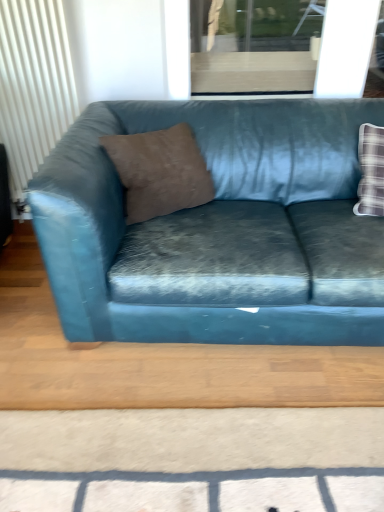
Question: Would you say white textured radiator at left is to the left or to the right of transparent glass window at upper center in the picture?

Choices:
 (A) left
 (B) right

Answer: (A)

Question: From the image's perspective, is white textured radiator at left positioned above or below transparent glass window at upper center?

Choices:
 (A) below
 (B) above

Answer: (A)

Question: Which object is positioned farthest from the white textured radiator at left?

Choices:
 (A) teal velvet couch at center
 (B) brown suede pillow at center
 (C) transparent glass window at upper center

Answer: (C)

Question: Based on their relative distances, which object is farther from the teal velvet couch at center?

Choices:
 (A) white textured radiator at left
 (B) brown suede pillow at center
 (C) transparent glass window at upper center

Answer: (A)